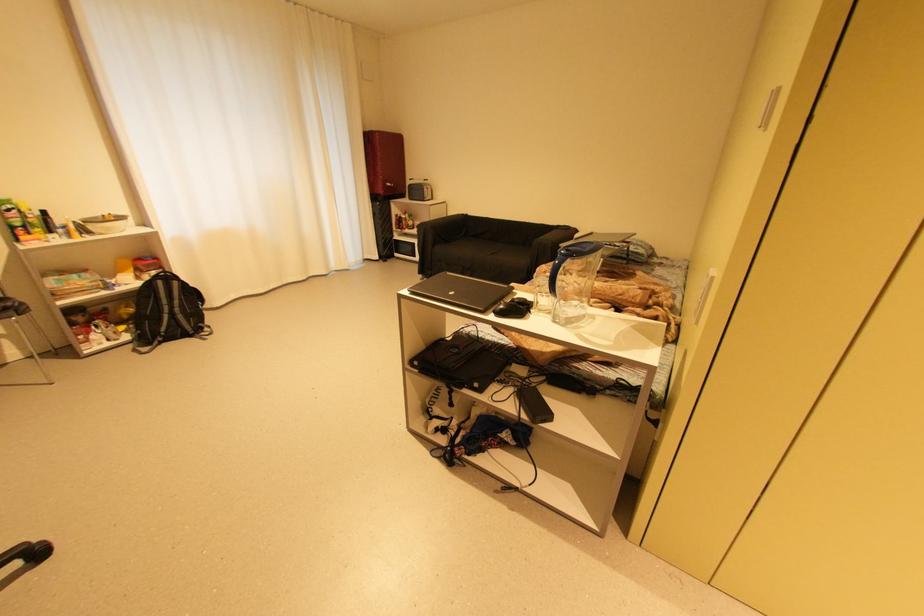
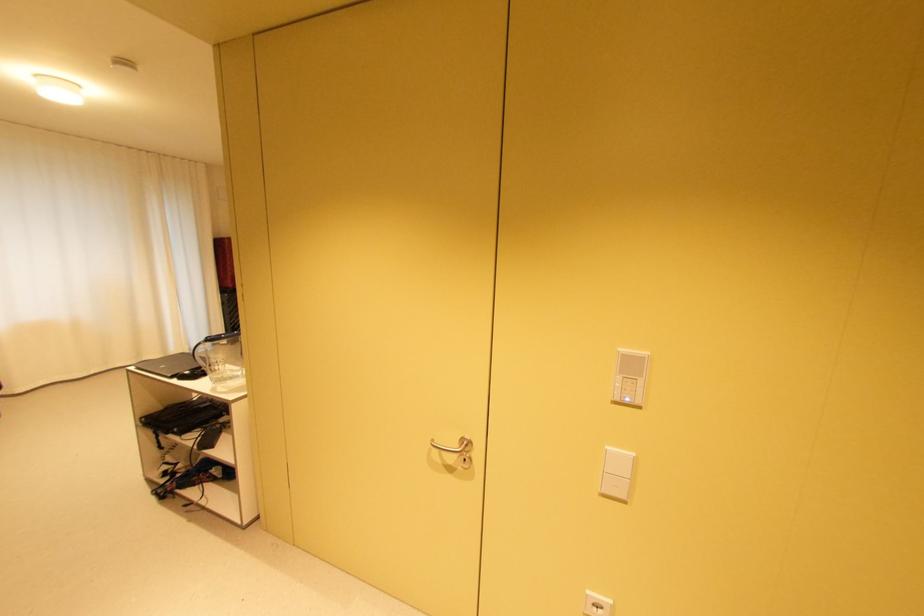
In a continuous first-person perspective shot, in which direction is the camera moving?

The cameraman walked toward right, backward.